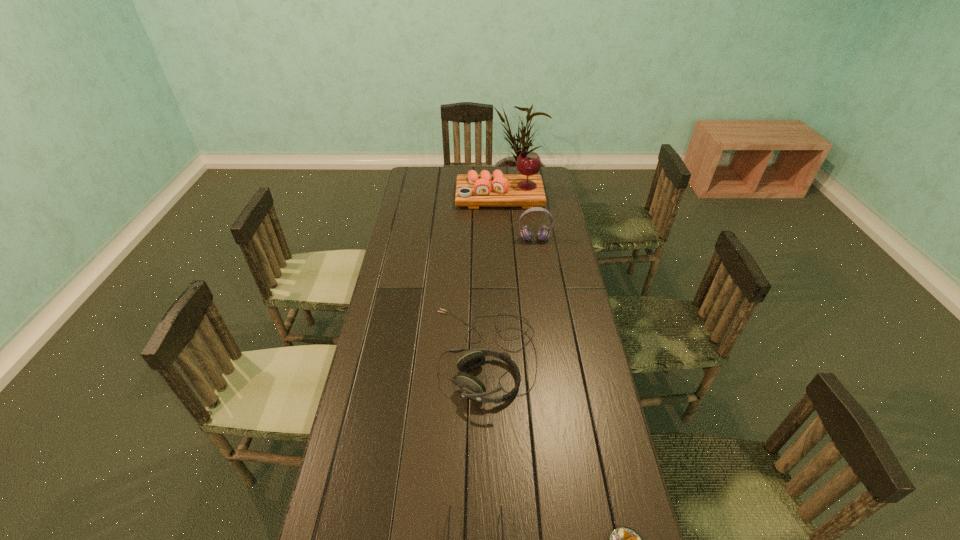
The height and width of the screenshot is (540, 960). I want to click on free spot located 0.080m on the outer surface of the shorter headset, so click(x=409, y=355).

The width and height of the screenshot is (960, 540). Identify the location of object situated at the far edge. (472, 190).

The image size is (960, 540). Identify the location of platter that is positioned at the right edge. (472, 190).

Locate an element on the screen. The width and height of the screenshot is (960, 540). headset that is at the right edge is located at coordinates (543, 233).

The image size is (960, 540). In order to click on object at the far right corner in this screenshot , I will do `click(472, 190)`.

Locate an element on the screen. vacant space at the far edge is located at coordinates (440, 188).

You are a GUI agent. You are given a task and a screenshot of the screen. Output one action in this format:
    pyautogui.click(x=<x>, y=<y>)
    Task: Click on the vacant space at the left edge of the desktop
    
    Given the screenshot: What is the action you would take?
    pyautogui.click(x=431, y=220)

Locate an element on the screen. blank space at the right edge of the desktop is located at coordinates (564, 257).

Find the location of `vacant area at the far left corner of the desktop`. vacant area at the far left corner of the desktop is located at coordinates (404, 187).

The height and width of the screenshot is (540, 960). I want to click on free space between the shorter headset and the tallest object, so click(x=492, y=275).